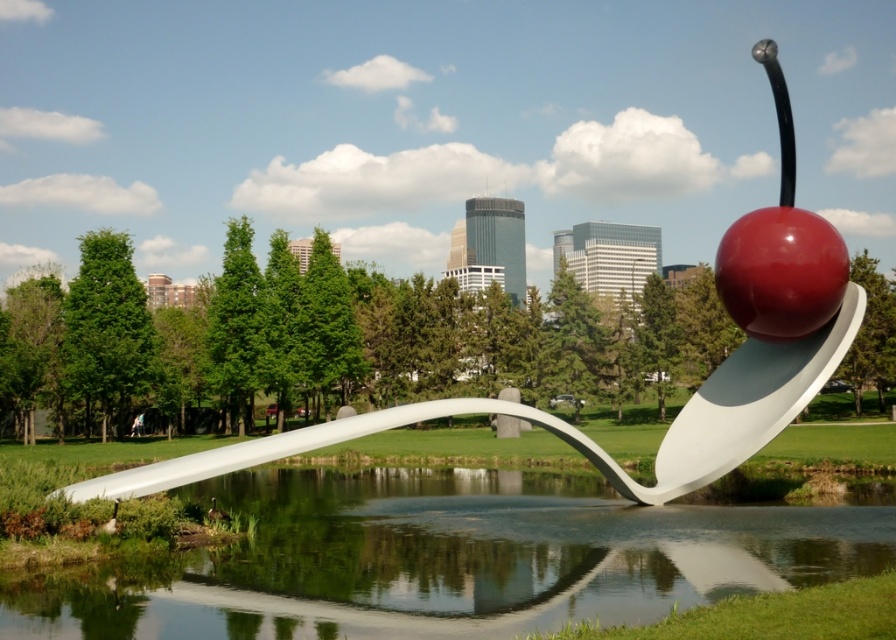
You are standing in the park and see the white glossy spoon at center and the glossy red cherry at upper right. Which object is located to the left of the other?

The white glossy spoon at center is positioned on the left side of glossy red cherry at upper right.

You are a photographer standing in the park and want to capture the reflection of the glossy red cherry at upper right in the transparent water at spoon center. Is the cherry positioned above the water so its reflection would be visible in the water?

The transparent water at spoon center is located below the glossy red cherry at upper right, so the cherry is positioned above the water. Therefore, its reflection should be visible in the transparent water at spoon center.

You are an artist planning to paint the sculpture and its reflection in the water. You need to know which object is taller between the transparent water at spoon center and the white glossy spoon at center. Can you tell me which one is taller?

The white glossy spoon at center is taller than transparent water at spoon center.